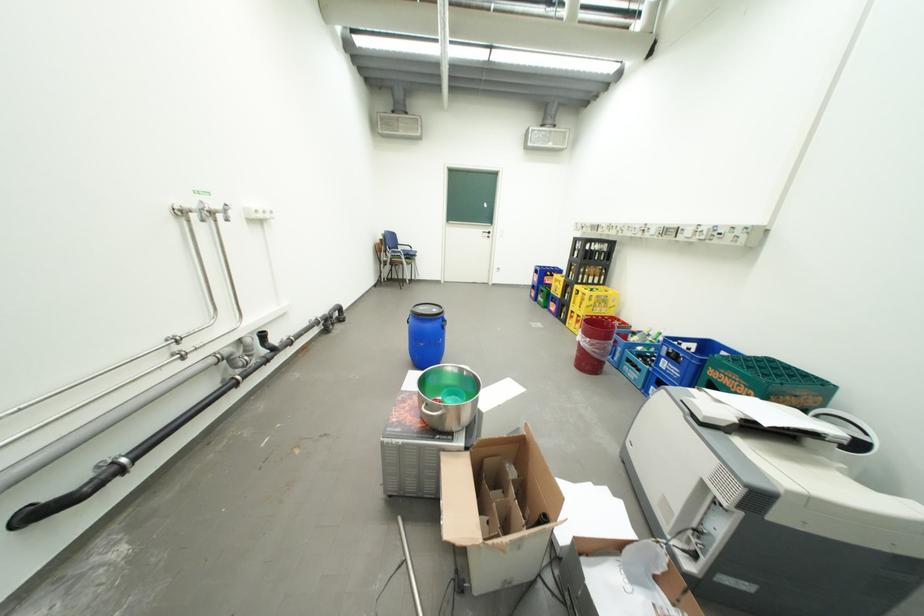
The width and height of the screenshot is (924, 616). What do you see at coordinates (487, 233) in the screenshot?
I see `a white door handle` at bounding box center [487, 233].